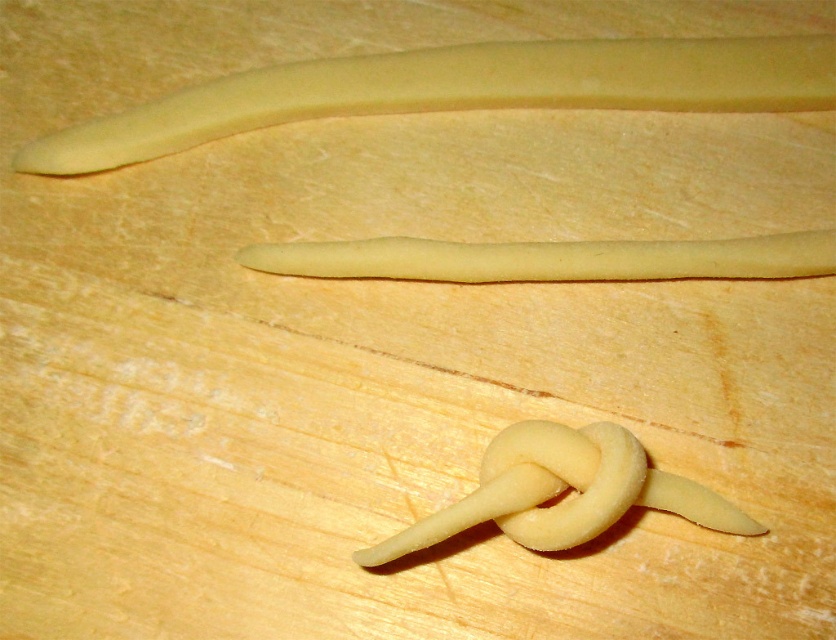
Does matte yellow dough at center come behind yellow dough stick at center?

No, it is in front of yellow dough stick at center.

Can you confirm if matte yellow dough at center is smaller than yellow dough stick at center?

Incorrect, matte yellow dough at center is not smaller in size than yellow dough stick at center.

Describe the element at coordinates (561, 492) in the screenshot. The width and height of the screenshot is (836, 640). I see `matte yellow dough at center` at that location.

Image resolution: width=836 pixels, height=640 pixels. I want to click on matte yellow dough at center, so click(x=561, y=492).

Does point (394, 65) come closer to viewer compared to point (493, 512)?

No, (394, 65) is behind (493, 512).

Can you confirm if yellow matte dough at upper center is positioned to the right of matte yellow dough at center?

No, yellow matte dough at upper center is not to the right of matte yellow dough at center.

Between point (77, 168) and point (763, 531), which one is positioned in front?

Positioned in front is point (763, 531).

Identify the location of yellow matte dough at upper center. (461, 90).

Can you confirm if yellow matte dough at upper center is wider than yellow dough stick at center?

Correct, the width of yellow matte dough at upper center exceeds that of yellow dough stick at center.

Does point (681, 60) come behind point (664, 268)?

Yes, it is behind point (664, 268).

This screenshot has width=836, height=640. In order to click on yellow matte dough at upper center in this screenshot , I will do `click(461, 90)`.